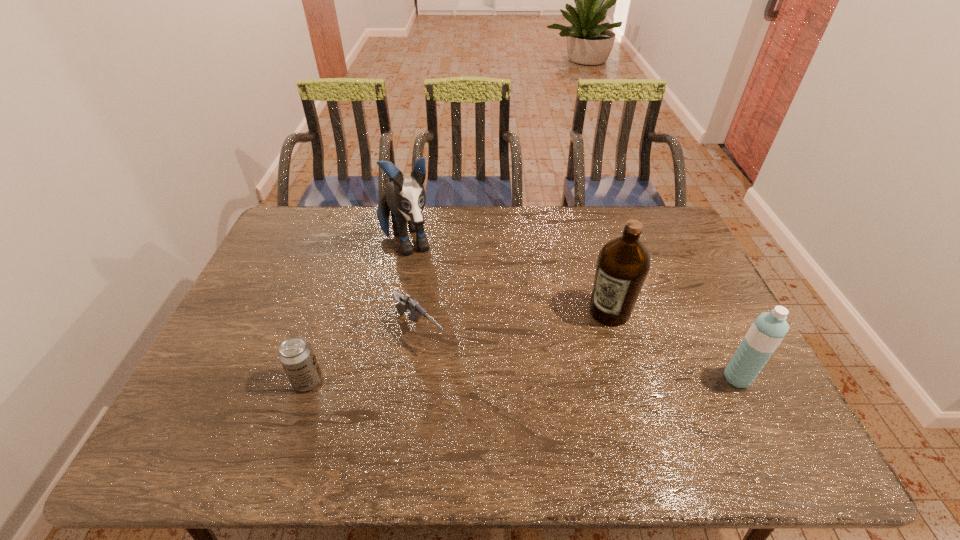
In order to click on the fourth closest object to the leftmost object in this screenshot , I will do (x=768, y=330).

Find the location of a particular element. vacant space that satisfies the following two spatial constraints: 1. on the front side of the olive oil; 2. on the right side of the tallest object is located at coordinates (394, 312).

The width and height of the screenshot is (960, 540). Identify the location of vacant area that satisfies the following two spatial constraints: 1. on the front side of the shortest object; 2. on the left side of the water bottle. (414, 378).